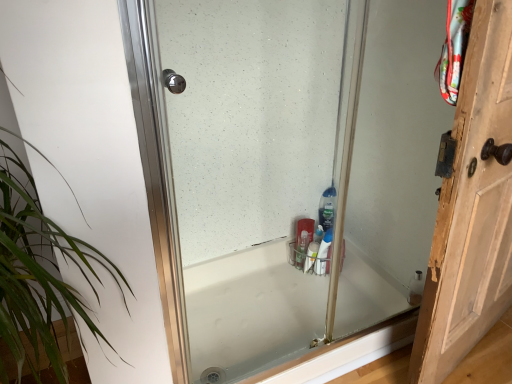
Locate an element on the screen. free location in front of white glossy bottle at lower right, the 1th cleaning product in the bottom-to-top sequence is located at coordinates (326, 301).